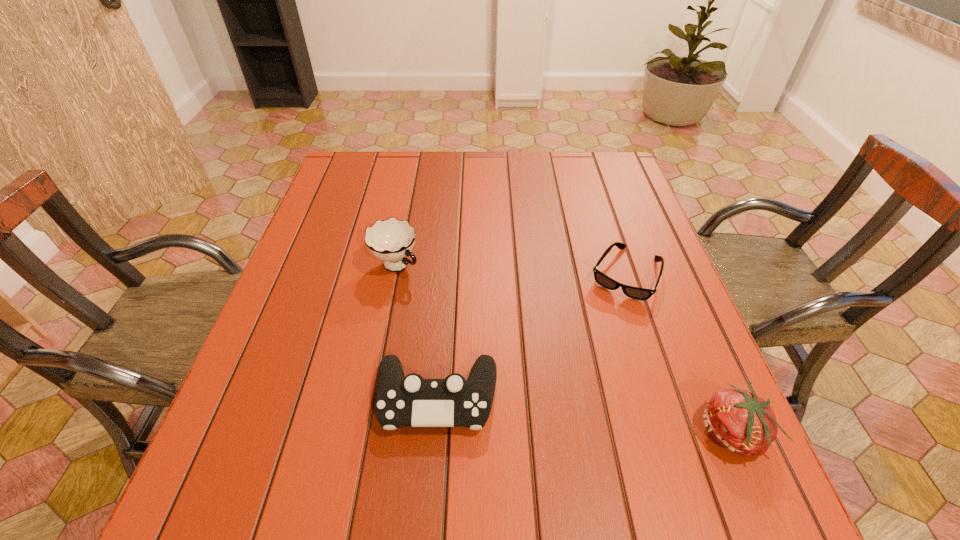
Image resolution: width=960 pixels, height=540 pixels. Identify the location of control. (401, 401).

The image size is (960, 540). In order to click on tomato in this screenshot , I will do `click(742, 422)`.

Identify the location of cup. (391, 240).

Find the location of `sunglasses`. sunglasses is located at coordinates (637, 293).

Find the location of a particular element. This screenshot has width=960, height=540. vacant area located 0.200m on the left of the tomato is located at coordinates (584, 433).

Identify the location of vacant space located 0.320m on the side of the cup with the handle. The width and height of the screenshot is (960, 540). (515, 354).

Where is `vacant space located on the side of the cup with the handle`? Image resolution: width=960 pixels, height=540 pixels. vacant space located on the side of the cup with the handle is located at coordinates click(x=444, y=301).

This screenshot has height=540, width=960. I want to click on free space located on the side of the cup with the handle, so click(x=500, y=343).

Locate an element on the screen. The height and width of the screenshot is (540, 960). vacant region located 0.200m on the front-facing side of the shortest object is located at coordinates (581, 364).

At what (x,y) coordinates should I click in order to perform the action: click on vacant space situated on the front-facing side of the shortest object. Please return your answer as a coordinate pair (x, y). This screenshot has width=960, height=540. Looking at the image, I should click on (538, 449).